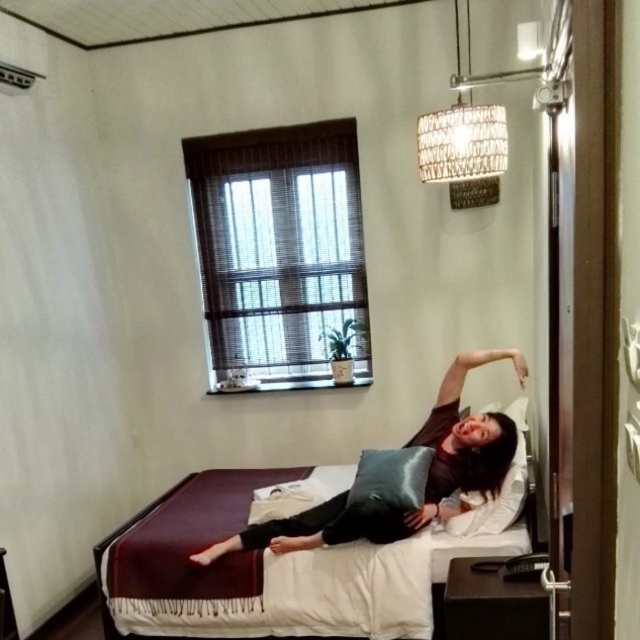
Question: Is dark brown leather pillow at center further to the viewer compared to silky black pillow at center?

Choices:
 (A) yes
 (B) no

Answer: (A)

Question: Does maroon fabric bed at center appear over silky black pillow at center?

Choices:
 (A) yes
 (B) no

Answer: (B)

Question: Which point is closer to the camera taking this photo?

Choices:
 (A) (372, 488)
 (B) (397, 531)

Answer: (B)

Question: Which of the following is the farthest from the observer?

Choices:
 (A) (369, 481)
 (B) (440, 432)

Answer: (B)

Question: Can you confirm if dark brown leather pillow at center is positioned to the left of silky black pillow at center?

Choices:
 (A) no
 (B) yes

Answer: (B)

Question: Among these objects, which one is nearest to the camera?

Choices:
 (A) maroon fabric bed at center
 (B) dark brown leather pillow at center

Answer: (A)